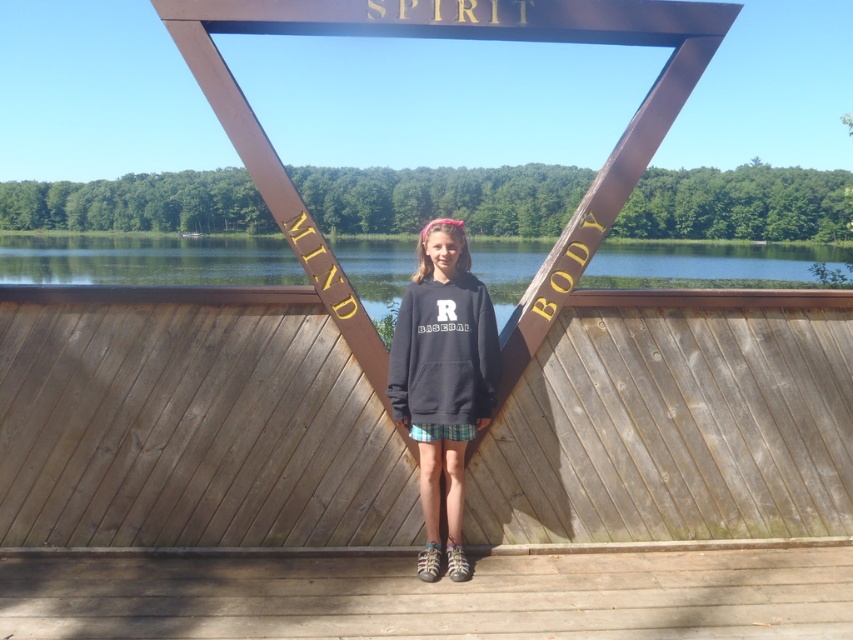
You are a fashion designer analyzing the clothing items in the image. Which of the following clothing items is thinner in material between the dark blue hoodie at center and the matte black sweatshirt at center?

The dark blue hoodie at center is thinner than the matte black sweatshirt at center according to the description.